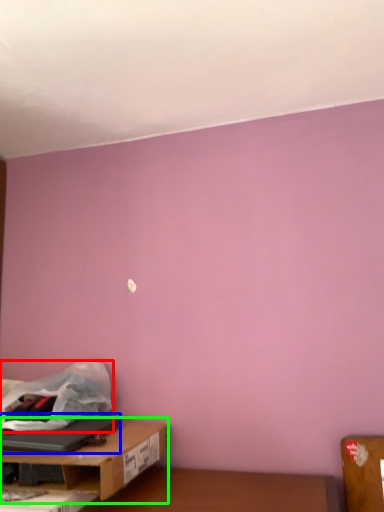
Question: Considering the real-world distances, which object is closest to plastic bag (highlighted by a red box)? laptop (highlighted by a blue box) or table (highlighted by a green box).

Choices:
 (A) laptop
 (B) table

Answer: (A)